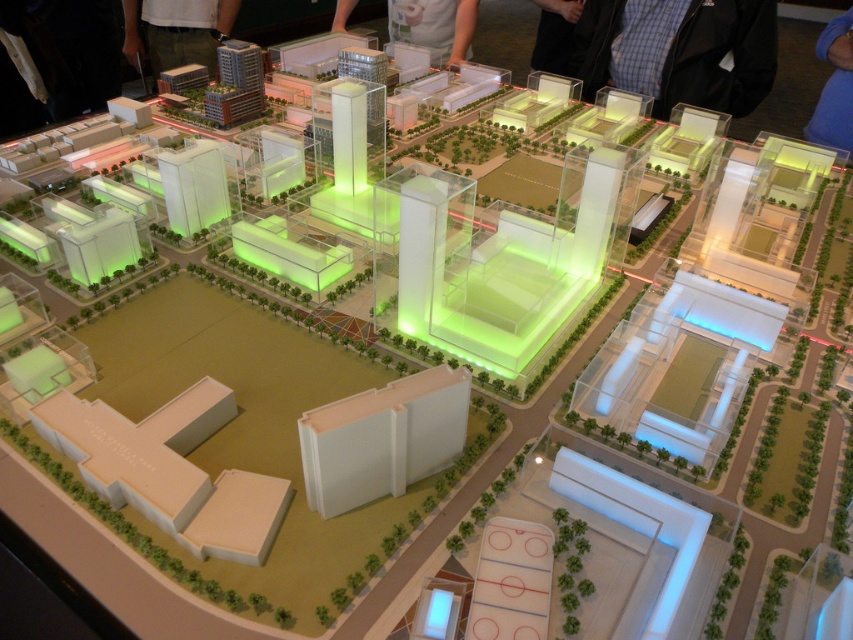
Does matte white shirt at upper center have a greater height compared to blue fabric at upper right?

No, matte white shirt at upper center is not taller than blue fabric at upper right.

Who is more forward, (x=456, y=0) or (x=838, y=145)?

Point (x=838, y=145) is in front.

Where is `matte white shirt at upper center`? The width and height of the screenshot is (853, 640). matte white shirt at upper center is located at coordinates point(434,26).

Is black fabric pants at upper left wider than matte white shirt at upper center?

Incorrect, black fabric pants at upper left's width does not surpass matte white shirt at upper center's.

Can you confirm if black fabric pants at upper left is positioned below matte white shirt at upper center?

No, black fabric pants at upper left is not below matte white shirt at upper center.

Is point (172, 40) positioned after point (389, 12)?

No.

In order to click on black fabric pants at upper left in this screenshot , I will do tap(177, 29).

Measure the distance from black fabric pants at upper left to blue fabric at upper right.

black fabric pants at upper left is 3.05 meters away from blue fabric at upper right.

Does black fabric pants at upper left have a lesser height compared to blue fabric at upper right?

Yes.

What do you see at coordinates (177, 29) in the screenshot?
I see `black fabric pants at upper left` at bounding box center [177, 29].

I want to click on black fabric pants at upper left, so click(x=177, y=29).